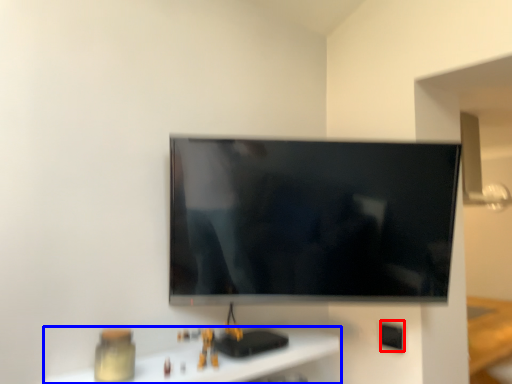
Question: Among these objects, which one is nearest to the camera, electric outlet (highlighted by a red box) or furniture (highlighted by a blue box)?

Choices:
 (A) electric outlet
 (B) furniture

Answer: (B)